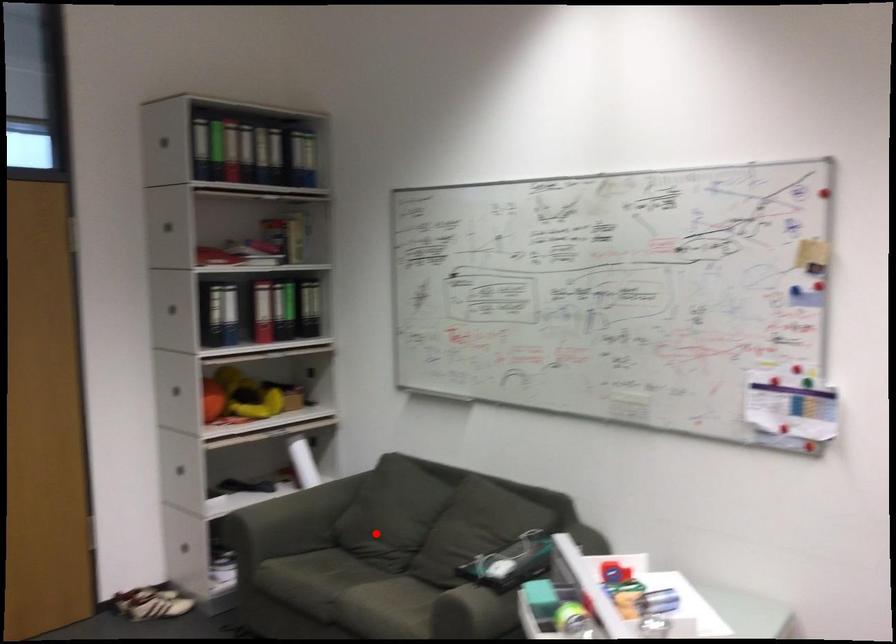
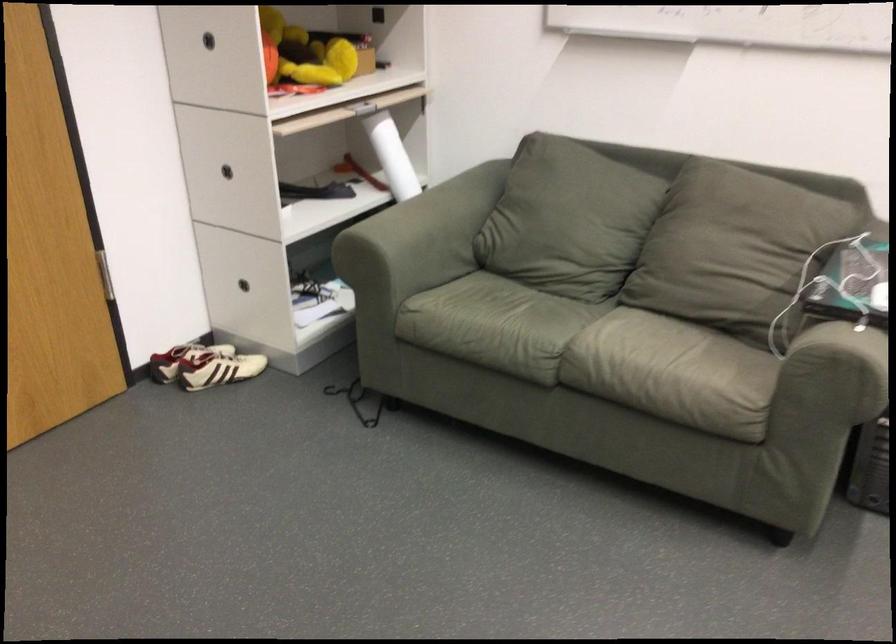
Question: I am providing you with two images of the same scene from different viewpoints. In image1, a red point is highlighted. Considering the same 3D point in image2, which of the following is correct?

Choices:
 (A) It is closer
 (B) It is farther

Answer: (A)